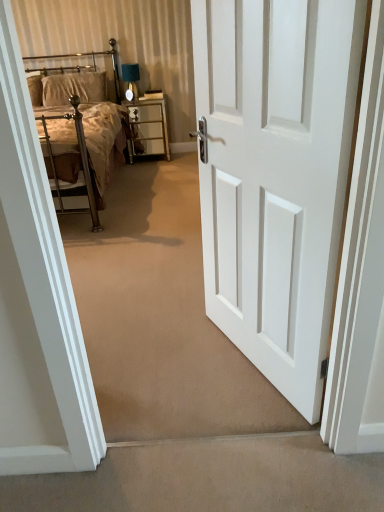
Question: From a real-world perspective, is velvet beige pillow at upper left below metallic gold nightstand at center?

Choices:
 (A) no
 (B) yes

Answer: (A)

Question: Are velvet beige pillow at upper left and metallic gold nightstand at center making contact?

Choices:
 (A) yes
 (B) no

Answer: (B)

Question: Could you tell me if velvet beige pillow at upper left is facing metallic gold nightstand at center?

Choices:
 (A) no
 (B) yes

Answer: (A)

Question: Is velvet beige pillow at upper left positioned beyond the bounds of metallic gold nightstand at center?

Choices:
 (A) no
 (B) yes

Answer: (B)

Question: Does velvet beige pillow at upper left contain metallic gold nightstand at center?

Choices:
 (A) yes
 (B) no

Answer: (B)

Question: Is velvet beige pillow at upper left positioned in front of metallic gold nightstand at center?

Choices:
 (A) no
 (B) yes

Answer: (B)

Question: Can you confirm if metallic silver bed at upper left is bigger than velvet beige pillow at upper left?

Choices:
 (A) no
 (B) yes

Answer: (B)

Question: Is metallic silver bed at upper left wider than velvet beige pillow at upper left?

Choices:
 (A) yes
 (B) no

Answer: (A)

Question: Is metallic silver bed at upper left smaller than velvet beige pillow at upper left?

Choices:
 (A) no
 (B) yes

Answer: (A)

Question: Considering the relative positions of metallic silver bed at upper left and velvet beige pillow at upper left in the image provided, is metallic silver bed at upper left to the left of velvet beige pillow at upper left from the viewer's perspective?

Choices:
 (A) no
 (B) yes

Answer: (B)

Question: Is the depth of metallic silver bed at upper left less than that of velvet beige pillow at upper left?

Choices:
 (A) no
 (B) yes

Answer: (B)

Question: Does metallic silver bed at upper left appear on the right side of velvet beige pillow at upper left?

Choices:
 (A) yes
 (B) no

Answer: (B)

Question: From a real-world perspective, is white painted wood door at center beneath velvet beige pillow at upper left?

Choices:
 (A) yes
 (B) no

Answer: (A)